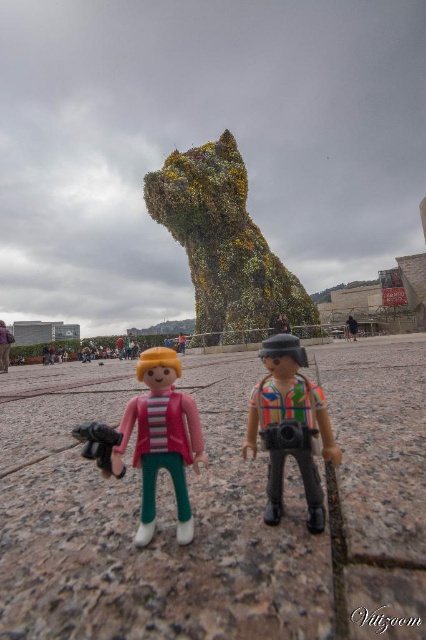
You are standing in the scene and want to take a photo of the large green topiary sculpture. The pink plastic figure at center is holding a camera. Can you use the camera to take a photo of the sculpture?

The pink plastic figure at center is holding a camera, so yes, you can use the camera to take a photo of the large green topiary sculpture.

You are a photographer standing near the green leafy sculpture at center and the multicolored fabric camera at center. You want to take a photo of the sculpture with the camera. Which object should you use to take the photo, and why?

You should use the multicolored fabric camera at center to take the photo of the green leafy sculpture at center because the camera is positioned below the sculpture, making it accessible for capturing the image.

You are standing at the point marked as point [161,440] in the image. Looking around, you see a large green topiary sculpture of a dog head in the background and two Playmobil figures in the foreground. Which Playmobil figure are you standing on?

You are standing on the pink plastic figure at center because the point [161,440] is located on that figure.